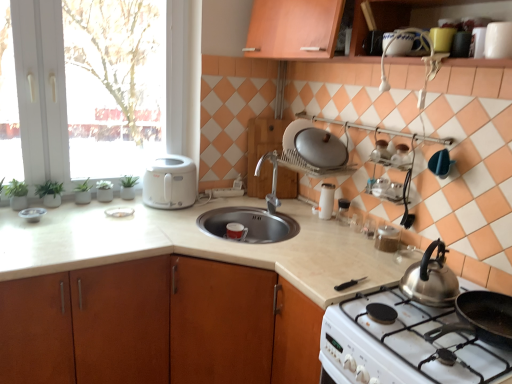
Find the location of a particular element. unoccupied region to the right of white glossy plate at left, acting as the 5th appliance starting from the right is located at coordinates (153, 213).